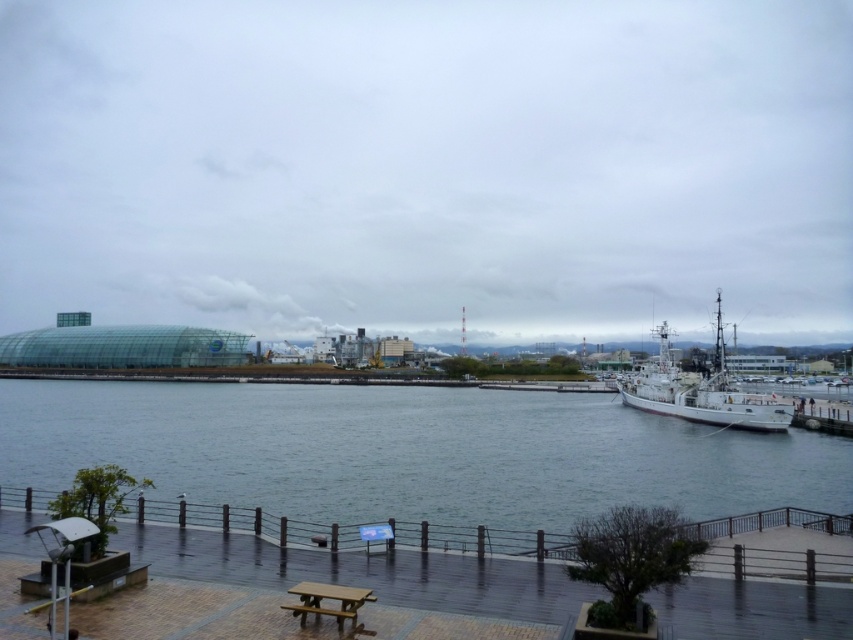
Question: Is transparent glass dome at center closer to the viewer compared to brown wooden bench at lower center?

Choices:
 (A) yes
 (B) no

Answer: (B)

Question: Can you confirm if blue water at center is positioned to the right of white matte boat at right?

Choices:
 (A) no
 (B) yes

Answer: (A)

Question: Which of the following is the farthest from the observer?

Choices:
 (A) blue water at center
 (B) transparent glass dome at center

Answer: (B)

Question: Which object appears closest to the camera in this image?

Choices:
 (A) wooden picnic table at lower center
 (B) brown wooden dock at lower center

Answer: (B)

Question: Does blue water at center have a greater width compared to brown wooden bench at lower center?

Choices:
 (A) no
 (B) yes

Answer: (B)

Question: Which object is the closest to the brown wooden dock at lower center?

Choices:
 (A) blue water at center
 (B) brown wooden bench at lower center
 (C) transparent glass dome at center

Answer: (B)